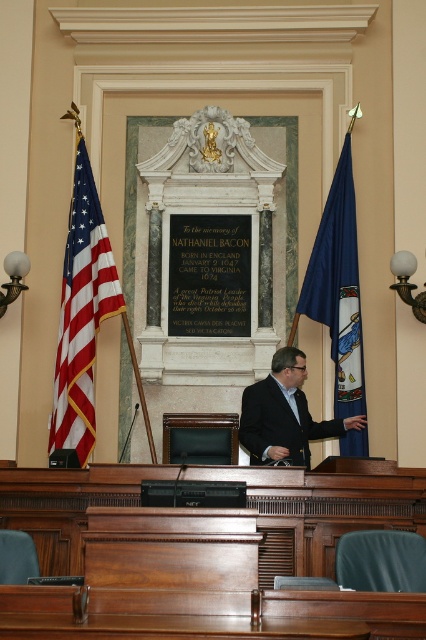
You are a photographer positioned in the center of the room. You want to take a photo of the blue fabric flag at right and the dark suit at center. Which object should you adjust your camera focus for first if you want both to be in clear view?

The blue fabric flag at right is further to the viewer than the dark suit at center, so you should focus on the blue fabric flag at right first to ensure both are in clear view.

You are standing in the legislative chamber and want to move from the first point to the second point. Can you walk directly from point (117, 275) to point (311, 314) without any obstacles?

Since point (117, 275) is behind point (311, 314), you cannot walk directly between them without moving around the obstacle in front.

You are a photographer standing in front of the marble monument. You need to capture a photo that includes both the blue fabric flag at right and the dark suit at center. Which object should you adjust your camera angle to include first if the flag is partially out of frame?

The blue fabric flag at right is shorter than the dark suit at center. Since the flag is shorter, you should adjust your camera angle to include the blue fabric flag at right first to ensure it is fully captured in the photo.